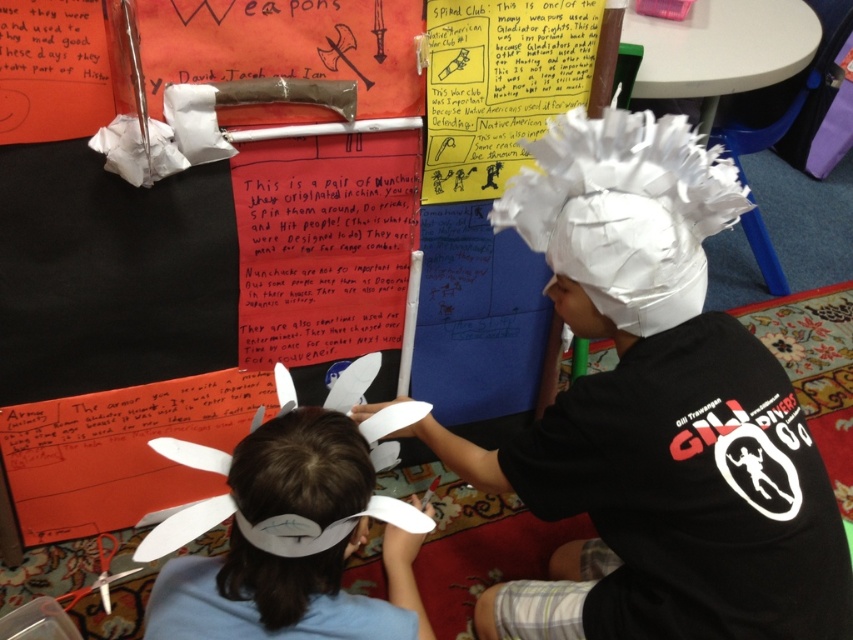
Question: Is white paper hat at upper center positioned in front of white paper hat at lower left?

Choices:
 (A) no
 (B) yes

Answer: (A)

Question: Which point is closer to the camera?

Choices:
 (A) white paper hat at upper center
 (B) white paper hat at lower left

Answer: (B)

Question: Can you confirm if white paper hat at upper center is smaller than white paper hat at lower left?

Choices:
 (A) yes
 (B) no

Answer: (B)

Question: Among these points, which one is farthest from the camera?

Choices:
 (A) (554, 172)
 (B) (200, 593)

Answer: (A)

Question: Is white paper hat at upper center positioned before white paper hat at lower left?

Choices:
 (A) yes
 (B) no

Answer: (B)